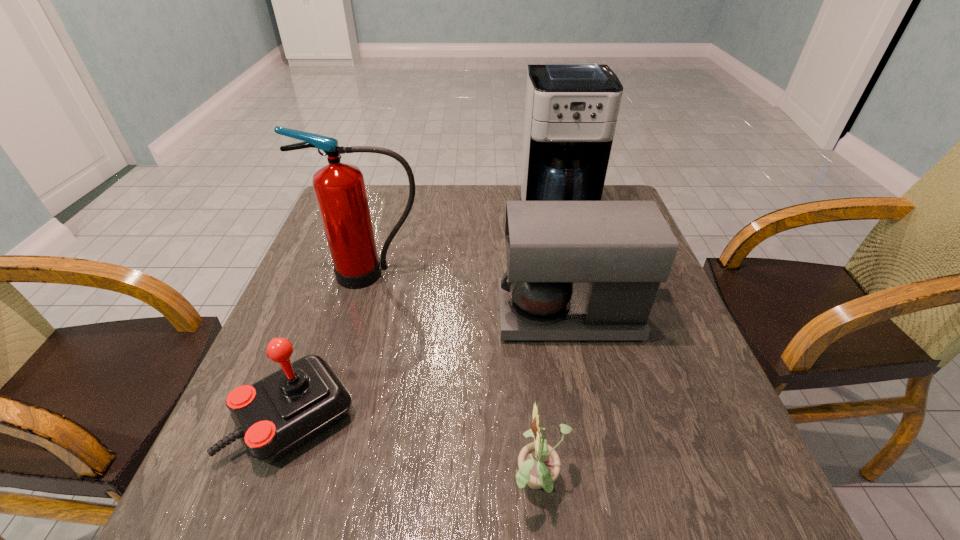
You are a GUI agent. You are given a task and a screenshot of the screen. Output one action in this format:
    pyautogui.click(x=<x>, y=<y>)
    Task: Click on the free spot between the second farthest object and the sunflower
    
    Given the screenshot: What is the action you would take?
    pyautogui.click(x=456, y=379)

Locate an element on the screen. This screenshot has height=540, width=960. empty space between the farthest object and the fire extinguisher is located at coordinates (465, 243).

You are a GUI agent. You are given a task and a screenshot of the screen. Output one action in this format:
    pyautogui.click(x=<x>, y=<y>)
    Task: Click on the free space between the sunflower and the joystick
    
    Given the screenshot: What is the action you would take?
    pyautogui.click(x=418, y=450)

Where is `free space between the farthest object and the sunflower`? Image resolution: width=960 pixels, height=540 pixels. free space between the farthest object and the sunflower is located at coordinates (549, 348).

Identify the location of empty space that is in between the joystick and the taller coffee maker. The image size is (960, 540). (427, 314).

The image size is (960, 540). What are the coordinates of `free space between the fourth nearest object and the joystick` in the screenshot? It's located at (334, 345).

Locate an element on the screen. This screenshot has width=960, height=540. free area in between the second farthest object and the joystick is located at coordinates (334, 345).

Identify which object is located as the third nearest to the farther coffee maker. Please provide its 2D coordinates. Your answer should be formatted as a tuple, i.e. [(x, y)], where the tuple contains the x and y coordinates of a point satisfying the conditions above.

[(274, 416)]

Identify which object is the second closest to the sunflower. Please provide its 2D coordinates. Your answer should be formatted as a tuple, i.e. [(x, y)], where the tuple contains the x and y coordinates of a point satisfying the conditions above.

[(274, 416)]

Locate an element on the screen. vacant region that satisfies the following two spatial constraints: 1. on the front panel of the farthest object; 2. on the carafe side of the shorter coffee maker is located at coordinates (584, 315).